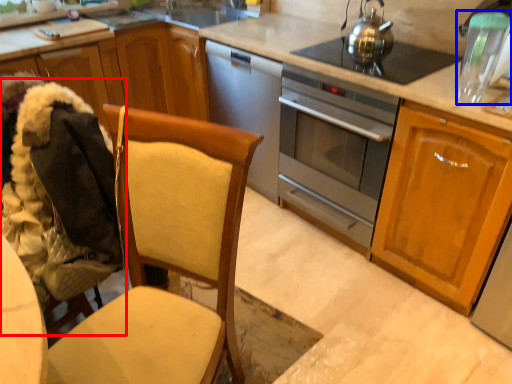
Question: Among these objects, which one is nearest to the camera, folding chair (highlighted by a red box) or appliance (highlighted by a blue box)?

Choices:
 (A) folding chair
 (B) appliance

Answer: (A)